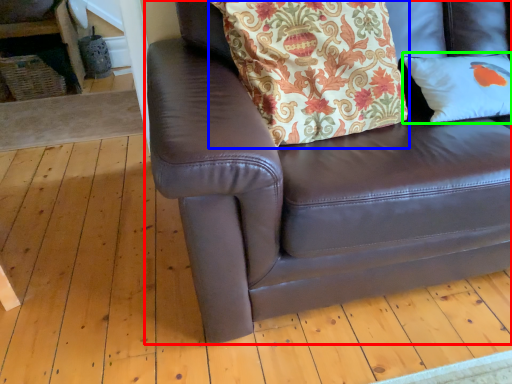
Question: Based on their relative distances, which object is farther from studio couch (highlighted by a red box)? Choose from blanket (highlighted by a blue box) and pillow (highlighted by a green box).

Choices:
 (A) blanket
 (B) pillow

Answer: (B)